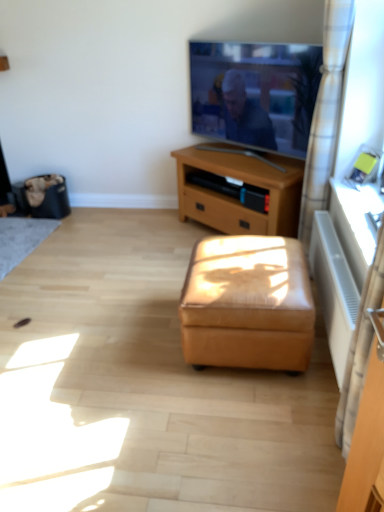
Where is `vacant space positioned to the left of brown wooden tv stand at center`? vacant space positioned to the left of brown wooden tv stand at center is located at coordinates (146, 240).